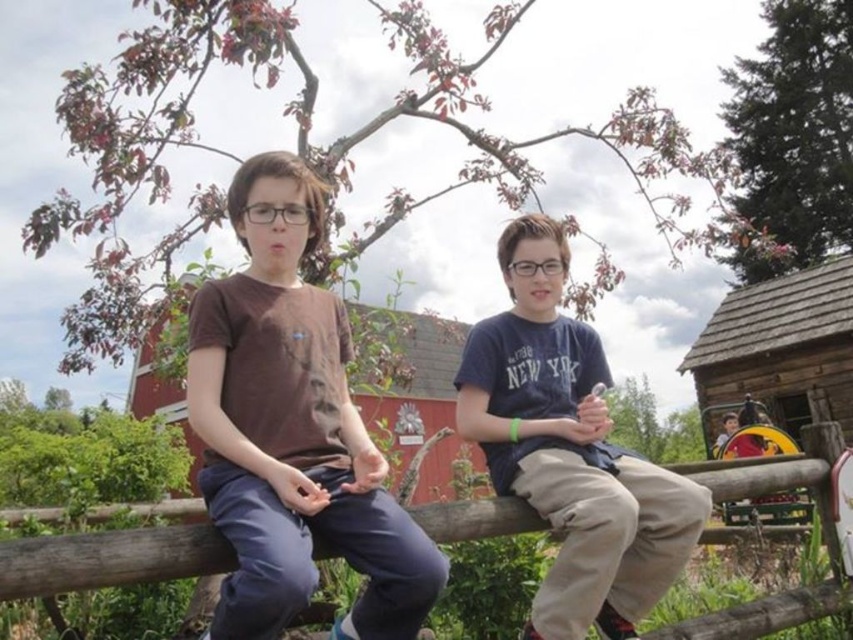
Is brown matte t-shirt at left behind blue cotton shirt at center?

No, brown matte t-shirt at left is in front of blue cotton shirt at center.

Who is shorter, brown matte t-shirt at left or blue cotton shirt at center?

brown matte t-shirt at left is shorter.

Which is behind, point (221, 524) or point (500, 394)?

The point (500, 394) is behind.

The height and width of the screenshot is (640, 853). I want to click on brown matte t-shirt at left, so click(x=292, y=429).

How distant is blue cotton shirt at center from wooden at center?

28.16 inches

Is point (613, 458) behind point (213, 529)?

Yes, it is behind point (213, 529).

Who is more forward, [625,621] or [467,508]?

Point [467,508] is more forward.

Locate an element on the screen. blue cotton shirt at center is located at coordinates (569, 451).

Does brown matte t-shirt at left have a smaller size compared to wooden at center?

Actually, brown matte t-shirt at left might be larger than wooden at center.

Image resolution: width=853 pixels, height=640 pixels. What do you see at coordinates (292, 429) in the screenshot? I see `brown matte t-shirt at left` at bounding box center [292, 429].

Between point (361, 506) and point (151, 570), which one is positioned behind?

The point (361, 506) is behind.

The height and width of the screenshot is (640, 853). Find the location of `brown matte t-shirt at left`. brown matte t-shirt at left is located at coordinates (292, 429).